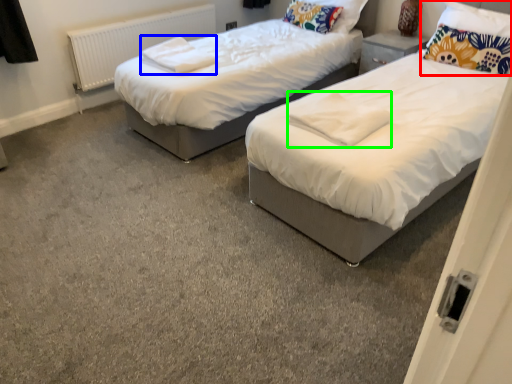
Question: Considering the real-world distances, which object is closest to pillow (highlighted by a red box)? linen (highlighted by a blue box) or linen (highlighted by a green box).

Choices:
 (A) linen
 (B) linen

Answer: (B)